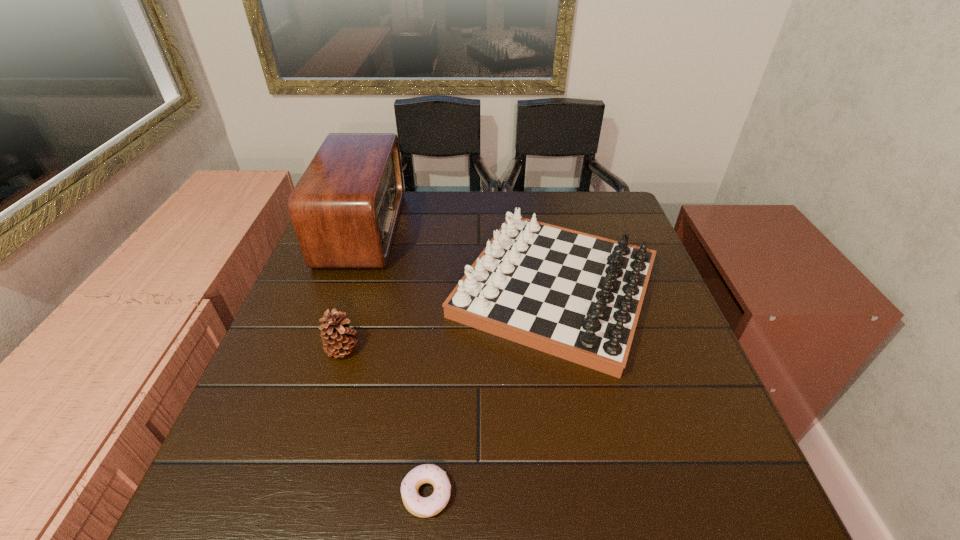
You are a GUI agent. You are given a task and a screenshot of the screen. Output one action in this format:
    pyautogui.click(x=<x>, y=<y>)
    Task: Click on the blank space that satisfies the following two spatial constraints: 1. on the front panel of the gameboard; 2. on the right side of the radio receiver
    The width and height of the screenshot is (960, 540).
    Given the screenshot: What is the action you would take?
    pyautogui.click(x=342, y=289)